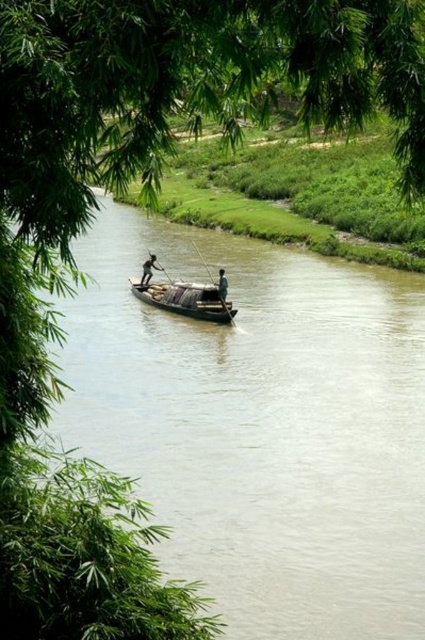
Is brown wooden canoe at center above light brown wooden pole at center?

Actually, brown wooden canoe at center is below light brown wooden pole at center.

Does brown wooden canoe at center lie in front of light brown wooden pole at center?

Yes.

Between point (170, 285) and point (221, 272), which one is positioned in front?

Point (221, 272) is more forward.

The height and width of the screenshot is (640, 425). Identify the location of brown wooden canoe at center. (186, 300).

Does brown wooden boat at center appear on the left side of brown wooden canoe at center?

In fact, brown wooden boat at center is to the right of brown wooden canoe at center.

Based on the photo, can you confirm if brown wooden boat at center is shorter than brown wooden canoe at center?

No, brown wooden boat at center is not shorter than brown wooden canoe at center.

Measure the distance between brown wooden boat at center and camera.

brown wooden boat at center and camera are 21.92 meters apart from each other.

This screenshot has height=640, width=425. Identify the location of brown wooden boat at center. (260, 426).

Does dark brown wooden boat at center appear on the left side of light brown wooden pole at center?

Yes, dark brown wooden boat at center is to the left of light brown wooden pole at center.

Can you confirm if dark brown wooden boat at center is positioned above light brown wooden pole at center?

Yes.

Between point (155, 259) and point (223, 296), which one is positioned behind?

The point (155, 259) is more distant.

Where is `dark brown wooden boat at center`? The image size is (425, 640). dark brown wooden boat at center is located at coordinates coord(149,268).